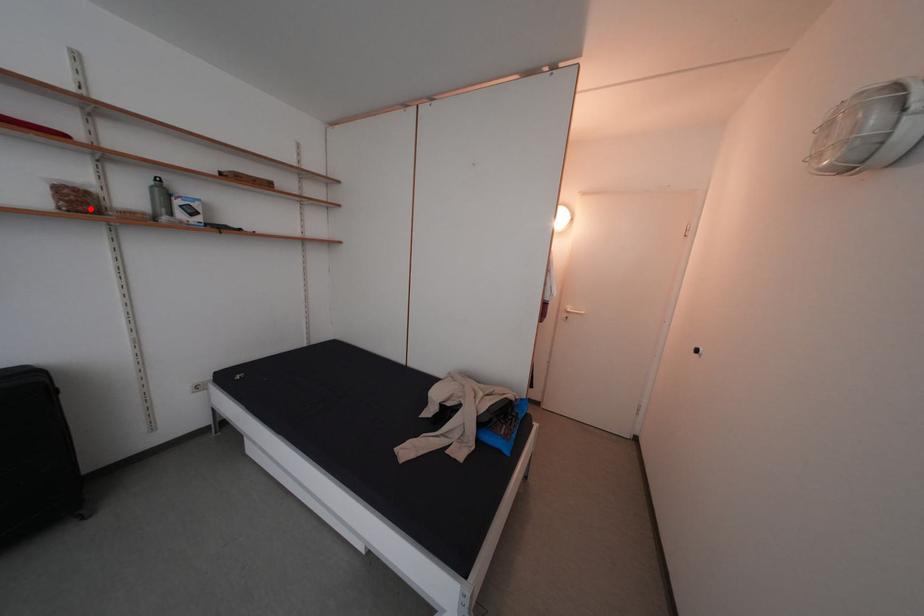
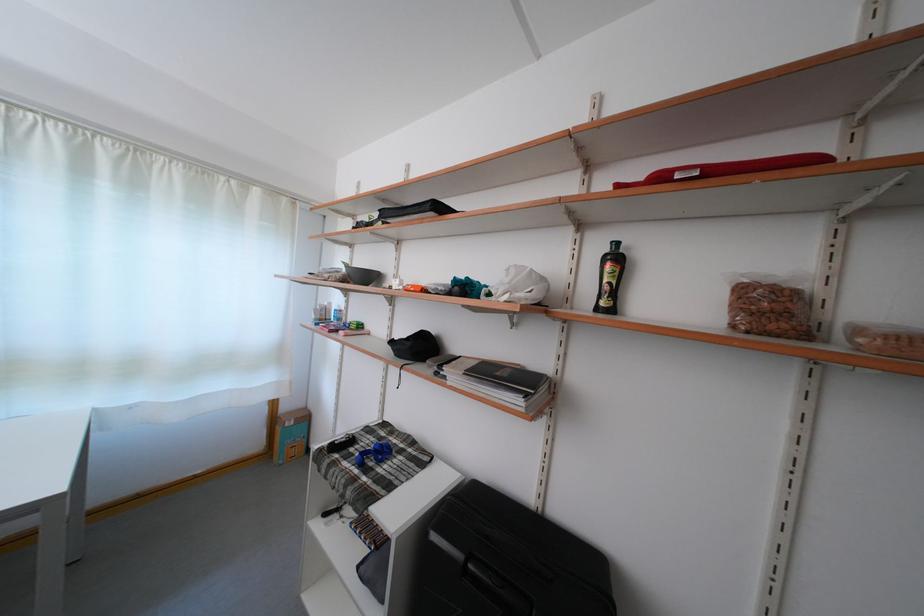
Find the pixel in the second image that matches the highlighted location in the first image.

(782, 321)